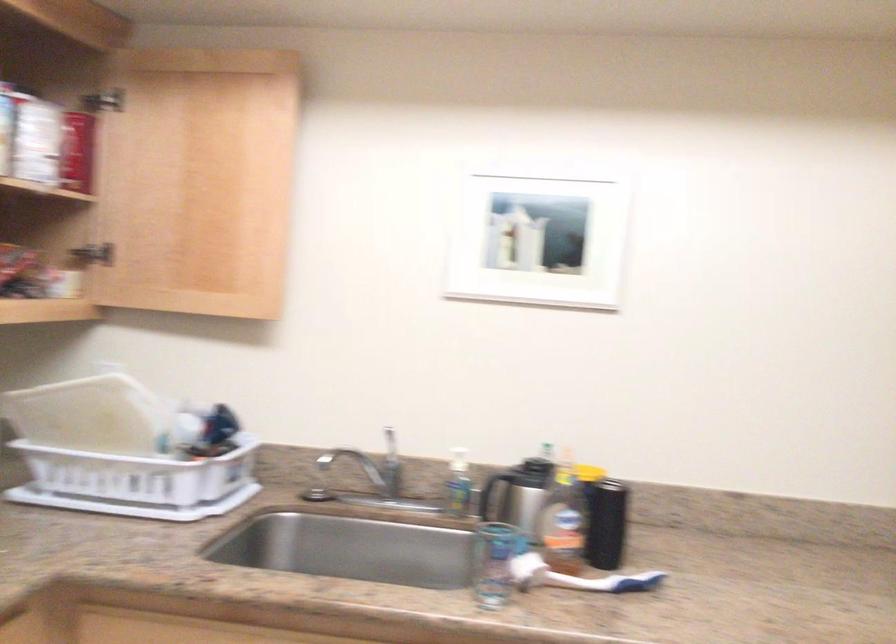
Find where to pull the wooden cabinet door. Please return your answer as a coordinate pair (x, y).

(209, 192)